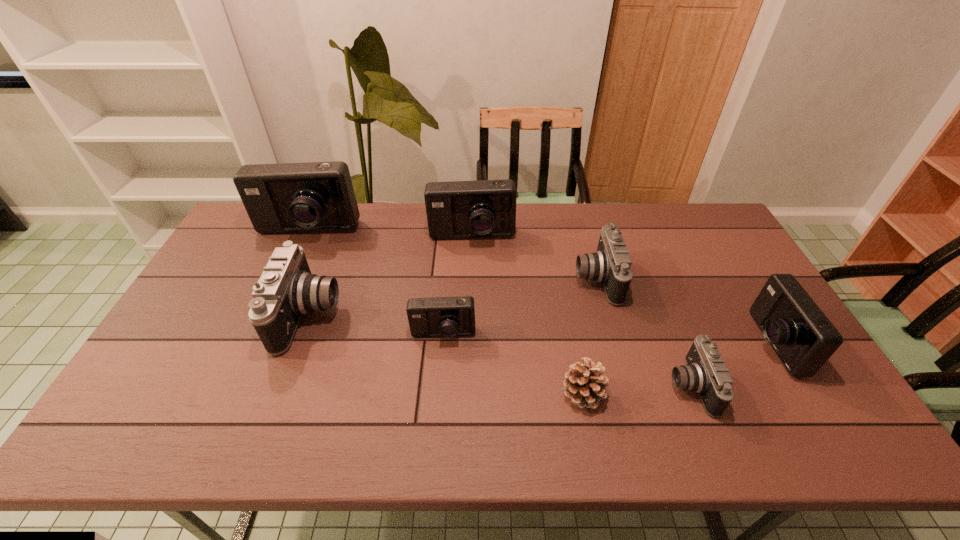
Locate an element on the screen. This screenshot has height=540, width=960. blue camera that stands as the closest to the third smallest blue camera is located at coordinates (316, 196).

I want to click on blue camera that stands as the third closest to the rightmost black camera, so click(484, 208).

This screenshot has height=540, width=960. Find the location of `black camera that stands as the closest to the smallest blue camera`. black camera that stands as the closest to the smallest blue camera is located at coordinates (286, 290).

Identify the location of black camera that is the third closest to the smallest blue camera. (706, 374).